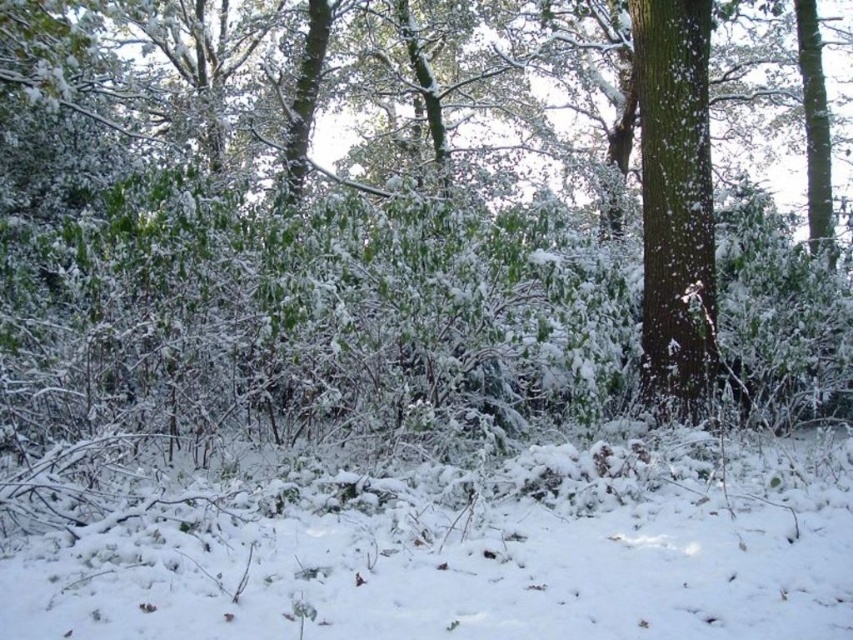
You are a hiker who has just arrived at the forest clearing. You need to place a 5 meter long rope between the white fluffy snow at lower center and the green rough bark tree at right. Will the rope be long enough to stretch between them?

The distance between the white fluffy snow at lower center and the green rough bark tree at right is 4.71 meters. Since the rope is 5 meters long, it will be long enough to stretch between them with some extra length remaining.

You are an animal trying to cross the forest floor. You see the white fluffy snow at lower center and the green rough bark tree at right. Which one is wider?

The white fluffy snow at lower center is wider than the green rough bark tree at right.

You are standing in the winter forest scene looking at the two points marked in the image. Which point, point (426, 580) or point (701, 51), is closer to you?

Point (426, 580) is closer to the camera than point (701, 51).